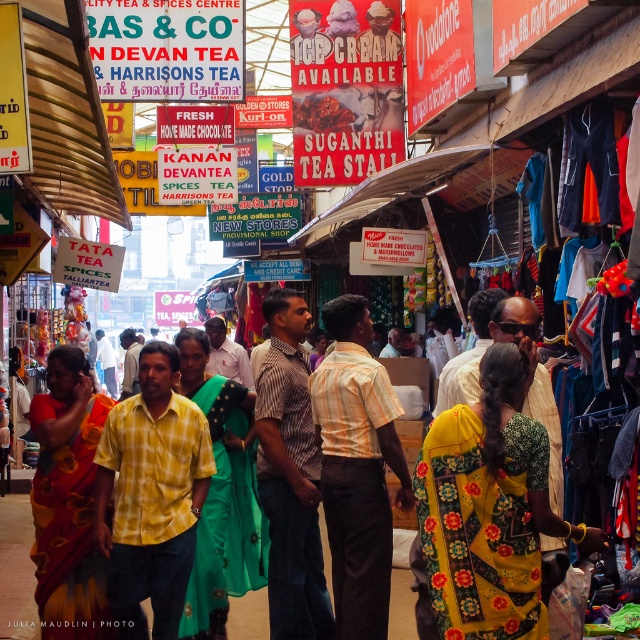
Question: Can you confirm if yellow striped shirt at center is thinner than striped shirt at center?

Choices:
 (A) no
 (B) yes

Answer: (A)

Question: Estimate the real-world distances between objects in this image. Which object is closer to the striped shirt at center?

Choices:
 (A) floral yellow sari at center
 (B) yellow cotton saree at center
 (C) yellow striped shirt at center

Answer: (C)

Question: Is yellow striped shirt at center further to camera compared to striped shirt at center?

Choices:
 (A) no
 (B) yes

Answer: (A)

Question: Based on their relative distances, which object is farther from the yellow striped shirt at center?

Choices:
 (A) yellow checkered shirt at center
 (B) floral yellow sari at center
 (C) yellow cotton saree at center
 (D) striped shirt at center

Answer: (C)

Question: Can you confirm if floral yellow sari at center is positioned to the right of yellow cotton saree at center?

Choices:
 (A) no
 (B) yes

Answer: (B)

Question: Which point is closer to the camera?

Choices:
 (A) (138, 564)
 (B) (272, 568)
 (C) (474, 548)
 (D) (49, 627)

Answer: (C)